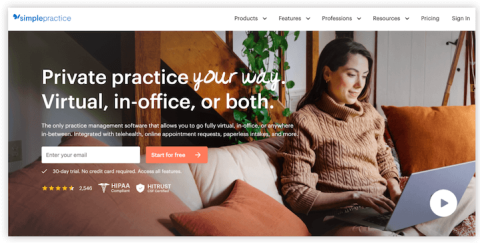
Identify the location of burnt orange colored couch cushion. This screenshot has height=243, width=480. (240, 214).